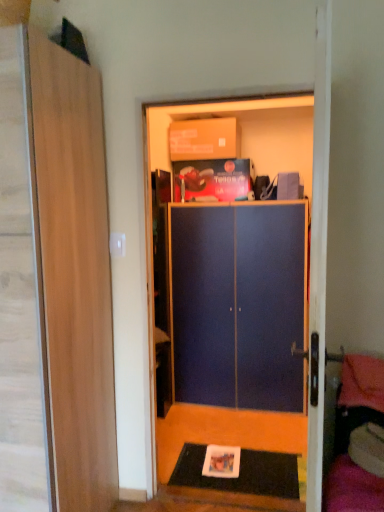
Where is `empty space that is ontop of blue matte cabinet at center (from a real-world perspective)`? empty space that is ontop of blue matte cabinet at center (from a real-world perspective) is located at coordinates (231, 95).